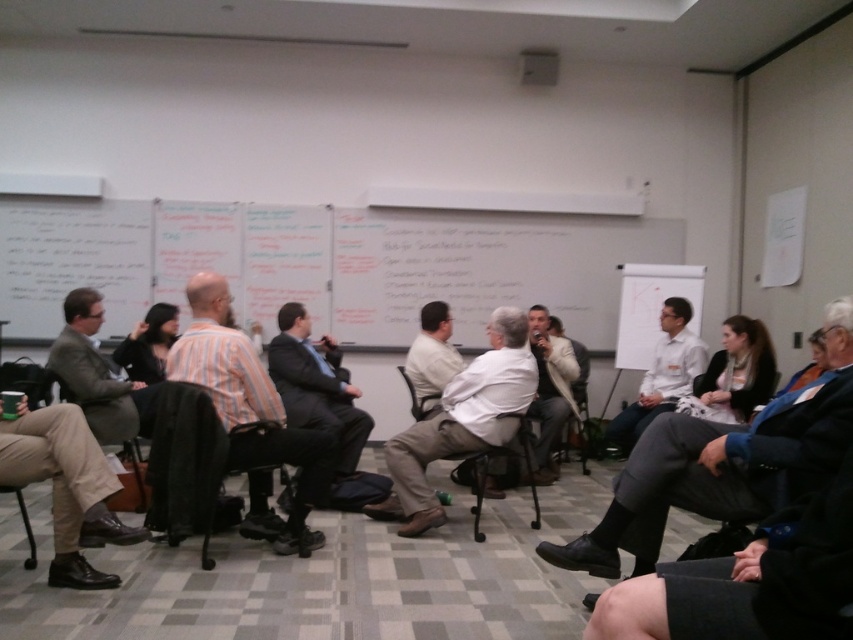
You are standing in the conference room and notice two points on the whiteboard. The first point is labeled as point (677, 358) and the second is labeled as point (579, 381). Which of these two points appears closer to you?

Point (677, 358) is closer to the camera than point (579, 381), so it appears closer to you.

You are a photographer positioned at the entrance of the conference room. You want to take a photo of the striped cotton shirt at center and the wooden chair at center such that both are clearly visible. Considering their sizes, which object should you focus on first to ensure proper exposure?

The striped cotton shirt at center is larger in size than the wooden chair at center, so you should focus on the striped cotton shirt at center first to ensure proper exposure.

You are a photographer standing at the back of the conference room. You want to take a photo of the white shirt at center and the wooden chair at center so that both are clearly visible in the frame. Given their distance apart, is it feasible to capture both in a single shot without zooming in or out?

The white shirt at center and wooden chair at center are 19.20 inches apart from each other. Since this distance is relatively small, it should be feasible to capture both in a single shot without needing to adjust the zoom, provided the camera is positioned appropriately to frame both elements within the shot.